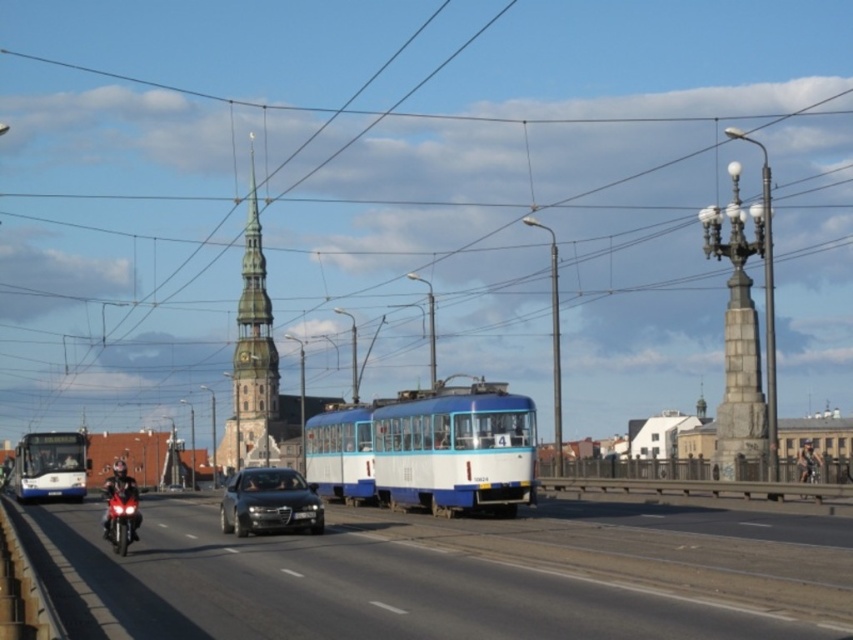
Who is shorter, black rubber motorcycle at lower left or blue matte tram at center?

Standing shorter between the two is black rubber motorcycle at lower left.

Is black rubber motorcycle at lower left above blue matte tram at center?

No, black rubber motorcycle at lower left is not above blue matte tram at center.

Is point (213, 593) positioned in front of point (340, 419)?

Yes, point (213, 593) is closer to viewer.

This screenshot has width=853, height=640. I want to click on black rubber motorcycle at lower left, so click(451, 576).

Does point (264, 266) come farther from viewer compared to point (814, 467)?

Yes, it is behind point (814, 467).

What do you see at coordinates (253, 352) in the screenshot? This screenshot has height=640, width=853. I see `smooth stone spire at center` at bounding box center [253, 352].

This screenshot has width=853, height=640. I want to click on smooth stone spire at center, so click(253, 352).

Is white glossy bus at left above shiny black motorcycle at center?

Actually, white glossy bus at left is below shiny black motorcycle at center.

Is point (32, 468) farther from camera compared to point (810, 467)?

Yes, point (32, 468) is farther from viewer.

Measure the distance between point (78,438) and camera.

Point (78,438) and camera are 65.08 meters apart from each other.

The height and width of the screenshot is (640, 853). I want to click on white glossy bus at left, so [x=49, y=467].